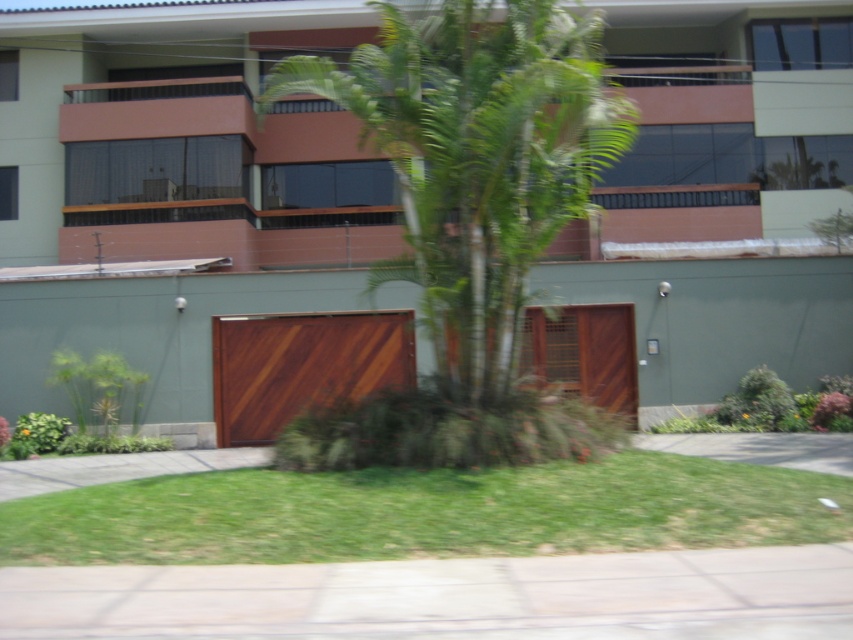
Which is behind, point (511, 321) or point (440, 628)?

Point (511, 321)

Who is more forward, (x=337, y=70) or (x=845, y=616)?

Point (x=845, y=616) is more forward.

Is point (422, 392) positioned before point (38, 580)?

No, (422, 392) is behind (38, 580).

Locate an element on the screen. The image size is (853, 640). green leafy palm tree at center is located at coordinates (468, 220).

Does wooden at center appear on the left side of gray concrete driveway at lower center?

Yes, wooden at center is to the left of gray concrete driveway at lower center.

Is wooden at center below gray concrete driveway at lower center?

Incorrect, wooden at center is not positioned below gray concrete driveway at lower center.

In order to click on wooden at center in this screenshot , I will do click(300, 365).

The width and height of the screenshot is (853, 640). I want to click on wooden at center, so click(x=300, y=365).

Does point (550, 529) lie in front of point (683, 452)?

Yes, it is.

Between point (811, 508) and point (683, 445), which one is positioned behind?

The point (683, 445) is behind.

Which is in front, point (737, 512) or point (722, 452)?

Point (737, 512) is in front.

Find the location of a particular element. green grass at lower center is located at coordinates (426, 513).